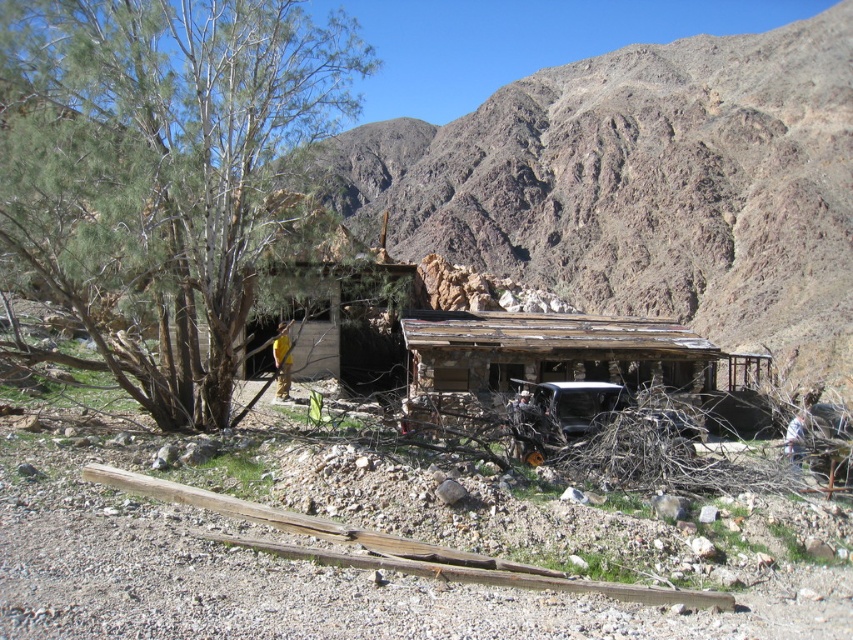
Question: Does rusty wood shack at center lie in front of weathered wood hut at center?

Choices:
 (A) yes
 (B) no

Answer: (B)

Question: Observing the image, what is the correct spatial positioning of rusty wood shack at center in reference to weathered wood hut at center?

Choices:
 (A) right
 (B) left

Answer: (A)

Question: Among these objects, which one is farthest from the camera?

Choices:
 (A) weathered wood hut at center
 (B) green leafy tree at left

Answer: (A)

Question: Where is rusty wood shack at center located in relation to green leafy tree at left in the image?

Choices:
 (A) above
 (B) below

Answer: (A)

Question: Based on their relative distances, which object is farther from the rusty wood shack at center?

Choices:
 (A) weathered wood hut at center
 (B) green leafy tree at left

Answer: (A)

Question: Which point is farther to the camera?

Choices:
 (A) green leafy tree at left
 (B) rusty wood shack at center

Answer: (B)